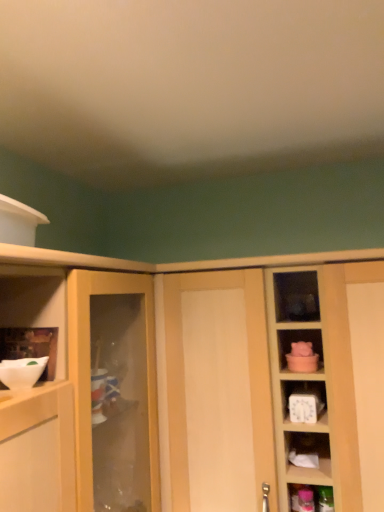
Question: Is white matte mixing bowl at left oriented towards white glossy bowl at left?

Choices:
 (A) no
 (B) yes

Answer: (A)

Question: Does white matte mixing bowl at left come in front of white glossy bowl at left?

Choices:
 (A) no
 (B) yes

Answer: (B)

Question: Considering the relative positions of white matte mixing bowl at left and white glossy bowl at left in the image provided, is white matte mixing bowl at left to the left of white glossy bowl at left from the viewer's perspective?

Choices:
 (A) no
 (B) yes

Answer: (A)

Question: From a real-world perspective, is white matte mixing bowl at left under white glossy bowl at left?

Choices:
 (A) no
 (B) yes

Answer: (B)

Question: Is white matte mixing bowl at left taller than white glossy bowl at left?

Choices:
 (A) no
 (B) yes

Answer: (A)

Question: From a real-world perspective, is light wood cabinet at center above or below white glossy bowl at left?

Choices:
 (A) above
 (B) below

Answer: (B)

Question: From the image's perspective, is light wood cabinet at center located above or below white glossy bowl at left?

Choices:
 (A) below
 (B) above

Answer: (A)

Question: Relative to white glossy bowl at left, is light wood cabinet at center in front or behind?

Choices:
 (A) front
 (B) behind

Answer: (B)

Question: Would you say light wood cabinet at center is to the left or to the right of white glossy bowl at left in the picture?

Choices:
 (A) right
 (B) left

Answer: (A)

Question: From a real-world perspective, is white matte mixing bowl at left positioned above or below white glossy bowl at left?

Choices:
 (A) below
 (B) above

Answer: (A)

Question: Considering the positions of white matte mixing bowl at left and white glossy bowl at left in the image, is white matte mixing bowl at left taller or shorter than white glossy bowl at left?

Choices:
 (A) short
 (B) tall

Answer: (A)

Question: Based on their sizes in the image, would you say white matte mixing bowl at left is bigger or smaller than white glossy bowl at left?

Choices:
 (A) small
 (B) big

Answer: (B)

Question: Would you say white matte mixing bowl at left is to the left or to the right of white glossy bowl at left in the picture?

Choices:
 (A) left
 (B) right

Answer: (B)

Question: Does point (52, 330) appear closer or farther from the camera than point (34, 364)?

Choices:
 (A) closer
 (B) farther

Answer: (B)

Question: From a real-world perspective, is white glossy bowl at left physically located above or below white matte mixing bowl at left?

Choices:
 (A) below
 (B) above

Answer: (B)